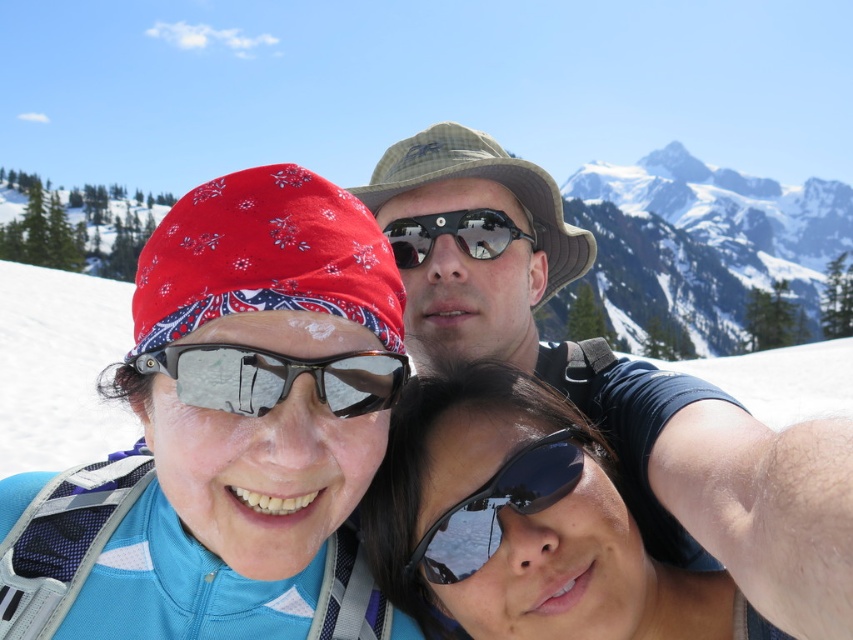
Who is shorter, camouflage fabric hat at center or transparent plastic goggles at center?

Standing shorter between the two is transparent plastic goggles at center.

Which is below, camouflage fabric hat at center or transparent plastic goggles at center?

transparent plastic goggles at center

Who is more forward, [830,636] or [260,385]?

Point [830,636] is in front.

This screenshot has width=853, height=640. What are the coordinates of `camouflage fabric hat at center` in the screenshot? It's located at (625, 388).

Is snowy white mountain at upper center thinner than black reflective sunglasses at center?

Incorrect, snowy white mountain at upper center's width is not less than black reflective sunglasses at center's.

Does snowy white mountain at upper center have a larger size compared to black reflective sunglasses at center?

Indeed, snowy white mountain at upper center has a larger size compared to black reflective sunglasses at center.

Where is `snowy white mountain at upper center`? The image size is (853, 640). snowy white mountain at upper center is located at coordinates (705, 241).

This screenshot has height=640, width=853. In order to click on snowy white mountain at upper center in this screenshot , I will do `click(705, 241)`.

Measure the distance from camouflage fabric hat at center to black reflective sunglasses at center.

camouflage fabric hat at center and black reflective sunglasses at center are 18.88 meters apart from each other.

Can you confirm if camouflage fabric hat at center is bigger than black reflective sunglasses at center?

Yes, camouflage fabric hat at center is bigger than black reflective sunglasses at center.

Which is in front, point (798, 612) or point (491, 509)?

Point (798, 612) is in front.

At what (x,y) coordinates should I click in order to perform the action: click on camouflage fabric hat at center. Please return your answer as a coordinate pair (x, y). The height and width of the screenshot is (640, 853). Looking at the image, I should click on (625, 388).